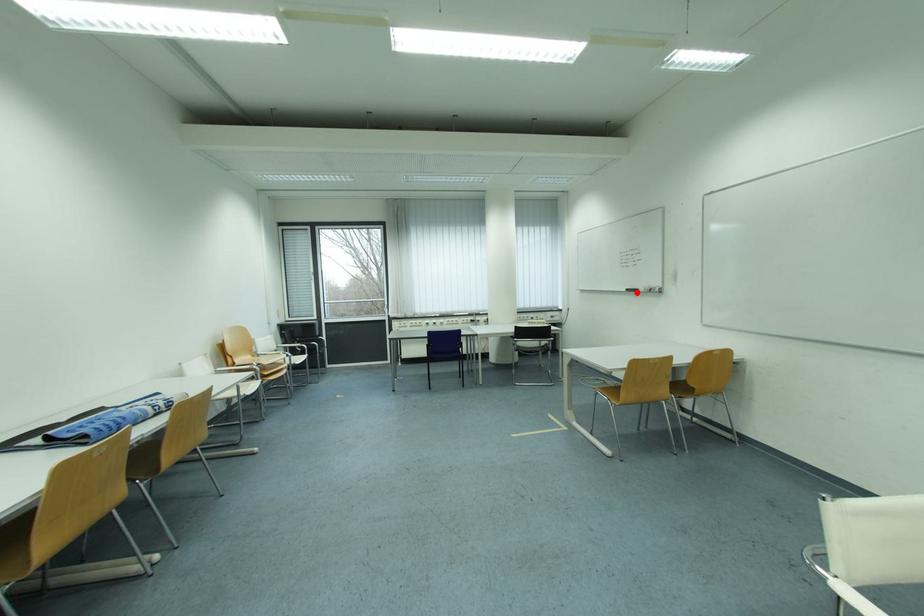
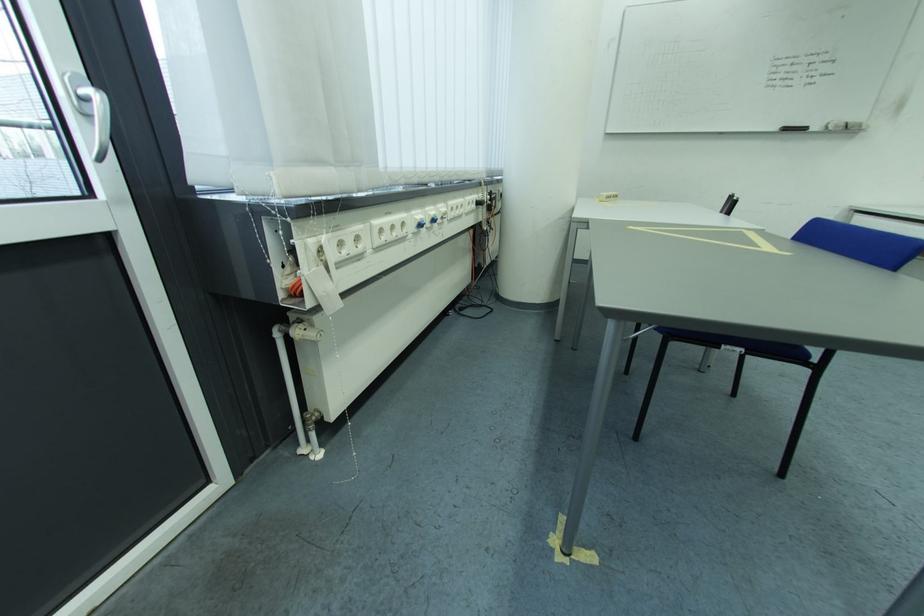
Question: I am providing you with two images of the same scene from different viewpoints. In image1, a red point is highlighted. Considering the same 3D point in image2, which of the following is correct?

Choices:
 (A) It is closer
 (B) It is farther

Answer: (B)